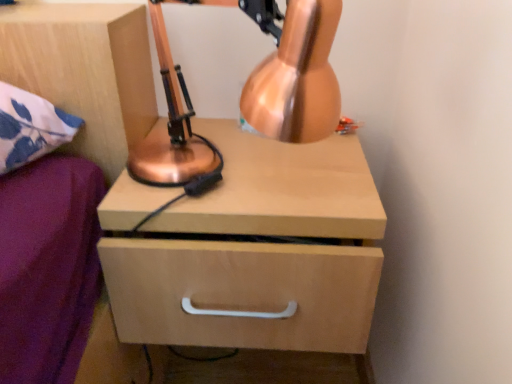
Where is `free space above light wood drawer at center (from a real-world perspective)`? This screenshot has height=384, width=512. free space above light wood drawer at center (from a real-world perspective) is located at coordinates (253, 173).